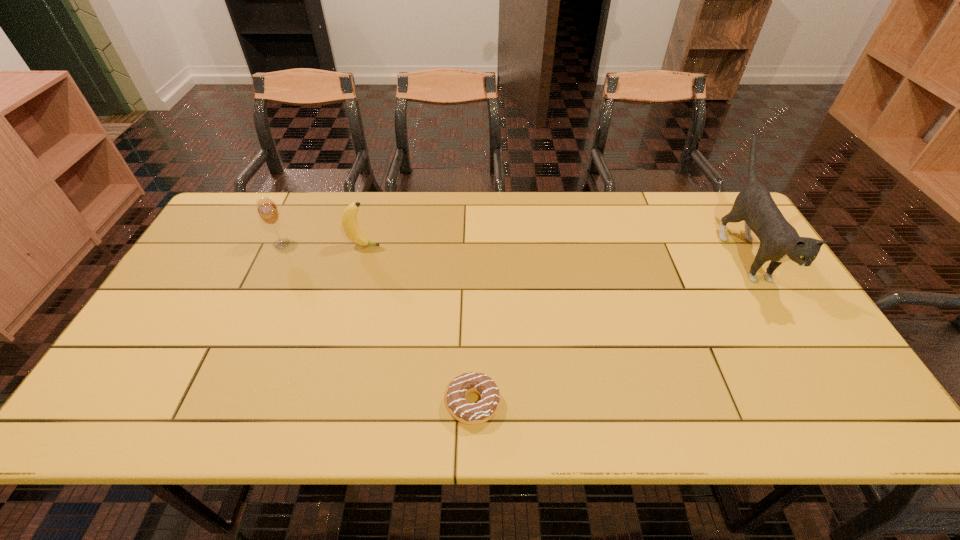
At what (x,y) coordinates should I click in order to perform the action: click on vacant region at the near right corner of the desktop. Please return your answer as a coordinate pair (x, y). This screenshot has width=960, height=540. Looking at the image, I should click on (805, 400).

Find the location of a particular element. empty space between the shortest object and the wineglass is located at coordinates (377, 323).

Where is `vacant point located between the nearest object and the banana`? This screenshot has height=540, width=960. vacant point located between the nearest object and the banana is located at coordinates (419, 325).

Where is `empty space between the leftmost object and the second object from right to left`? This screenshot has height=540, width=960. empty space between the leftmost object and the second object from right to left is located at coordinates (377, 323).

In order to click on vacant point located between the doughnut and the banana in this screenshot , I will do `click(419, 325)`.

At what (x,y) coordinates should I click in order to perform the action: click on free space between the doughnut and the leftmost object. Please return your answer as a coordinate pair (x, y). The image size is (960, 540). Looking at the image, I should click on (377, 323).

Where is `empty space that is in between the banana and the wineglass`? This screenshot has width=960, height=540. empty space that is in between the banana and the wineglass is located at coordinates (323, 245).

Where is `vacant area that lies between the nearest object and the second object from left to right`? This screenshot has width=960, height=540. vacant area that lies between the nearest object and the second object from left to right is located at coordinates (419, 325).

Where is `free spot between the doughnut and the cat`? This screenshot has height=540, width=960. free spot between the doughnut and the cat is located at coordinates (609, 328).

Where is `empty space that is in between the wineglass and the cat`? This screenshot has height=540, width=960. empty space that is in between the wineglass and the cat is located at coordinates (513, 248).